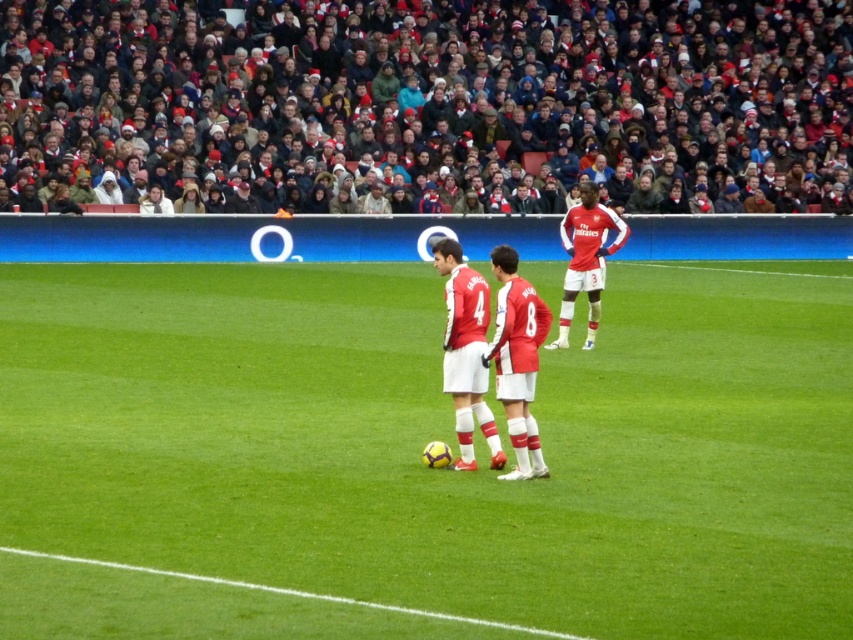
You are a soccer player standing at the edge of the field. You need to kick the ball from the smooth green grass at center to the green grass at lower center. Which area requires a stronger kick to cover the distance?

The smooth green grass at center has a greater width than the green grass at lower center, so kicking the ball to the green grass at lower center would require a stronger kick since it is farther away.

From the picture: You are a soccer player standing at the edge of the field. You need to kick the ball from the green grass at lower center to the smooth green grass at center. Which direction should you kick the ball?

The smooth green grass at center is to the right of green grass at lower center, so you should kick the ball to the right.

You are a photographer standing at the edge of the soccer field. You want to take a photo that includes both the matte red jersey at center and the green grass at lower center. Based on their positions, which object should you focus on first to ensure both are in sharp focus?

The matte red jersey at center is above green grass at lower center. To ensure both are in sharp focus, you should focus on the matte red jersey at center first since it is closer to the camera, and the green grass at lower center will naturally fall within the depth of field when focusing on the closer object.